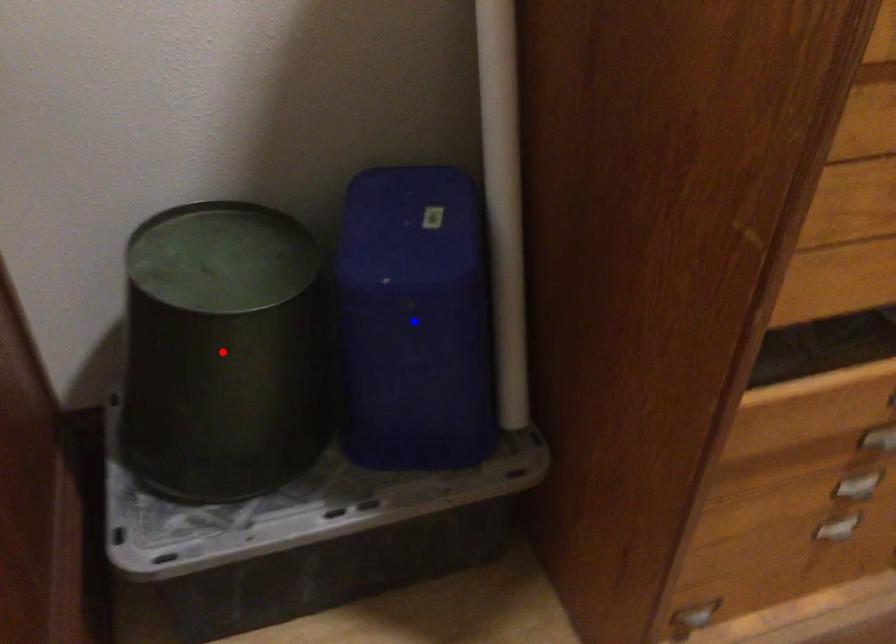
Question: Which of the two points in the image is closer to the camera?

Choices:
 (A) Blue point is closer.
 (B) Red point is closer.

Answer: (B)